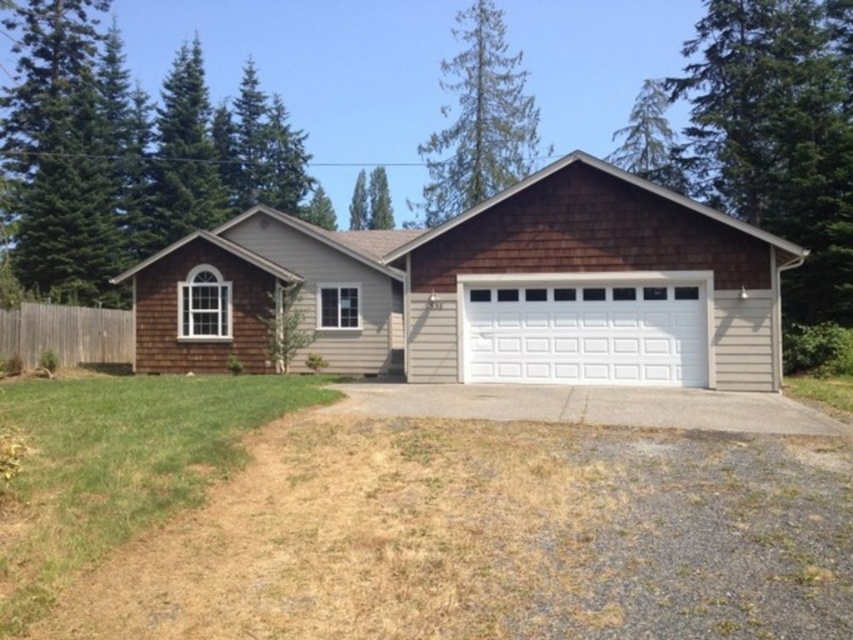
Can you confirm if brown shingles at center is smaller than white painted wood garage door at center?

Incorrect, brown shingles at center is not smaller in size than white painted wood garage door at center.

Does brown shingles at center have a lesser width compared to white painted wood garage door at center?

Incorrect, brown shingles at center's width is not less than white painted wood garage door at center's.

Is point (445, 259) less distant than point (643, 342)?

No, (445, 259) is further to viewer.

Locate an element on the screen. The height and width of the screenshot is (640, 853). brown shingles at center is located at coordinates coord(486,291).

Can you confirm if brown shingles at center is smaller than gray asphalt driveway at center?

Actually, brown shingles at center might be larger than gray asphalt driveway at center.

Can you confirm if brown shingles at center is positioned above gray asphalt driveway at center?

Yes, brown shingles at center is above gray asphalt driveway at center.

Does point (352, 305) come closer to viewer compared to point (805, 420)?

No, it is not.

Identify the location of brown shingles at center. This screenshot has height=640, width=853. (486, 291).

Is white painted wood garage door at center thinner than gray asphalt driveway at center?

Indeed, white painted wood garage door at center has a lesser width compared to gray asphalt driveway at center.

Does point (503, 372) come in front of point (573, 392)?

No, it is not.

This screenshot has width=853, height=640. What do you see at coordinates (585, 328) in the screenshot?
I see `white painted wood garage door at center` at bounding box center [585, 328].

Image resolution: width=853 pixels, height=640 pixels. In order to click on white painted wood garage door at center in this screenshot , I will do `click(585, 328)`.